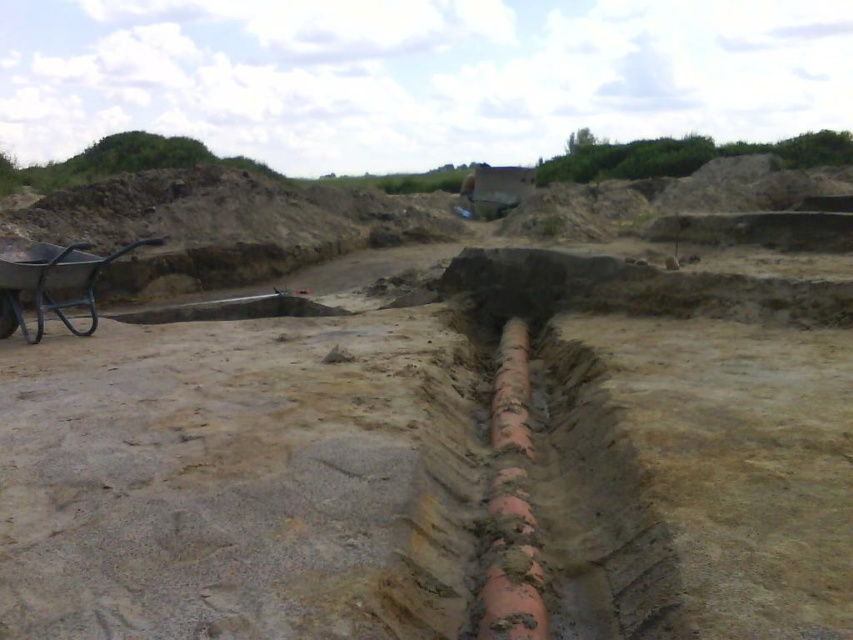
You are a construction worker standing at the trench edge near the pipe. You need to move materials from the wheelbarrow to a point closer to you. Which point should you go to, point (x=498, y=360) or point (x=68, y=298)?

You should go to point (x=498, y=360) because it is closer to the viewer than point (x=68, y=298).